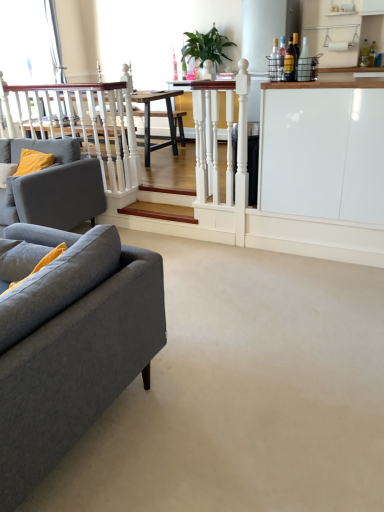
Question: Is point (276, 198) closer or farther from the camera than point (79, 185)?

Choices:
 (A) closer
 (B) farther

Answer: (A)

Question: Based on their sizes in the image, would you say white glossy cabinet at right is bigger or smaller than matte gray fabric couch at left, which appears as the 2th studio couch when viewed from the front?

Choices:
 (A) small
 (B) big

Answer: (A)

Question: Which of these objects is positioned farthest from the wooden stairs at center?

Choices:
 (A) matte gray fabric couch at left, which ranks as the first studio couch in back-to-front order
 (B) gray fabric couch at left, the 2th studio couch from the back
 (C) white glossy cabinet at right
 (D) green leafy plant at upper center

Answer: (B)

Question: Estimate the real-world distances between objects in this image. Which object is farther from the green leafy plant at upper center?

Choices:
 (A) white glossy cabinet at right
 (B) wooden stairs at center
 (C) matte gray fabric couch at left, which ranks as the first studio couch in back-to-front order
 (D) gray fabric couch at left, which is counted as the 1th studio couch, starting from the front

Answer: (D)